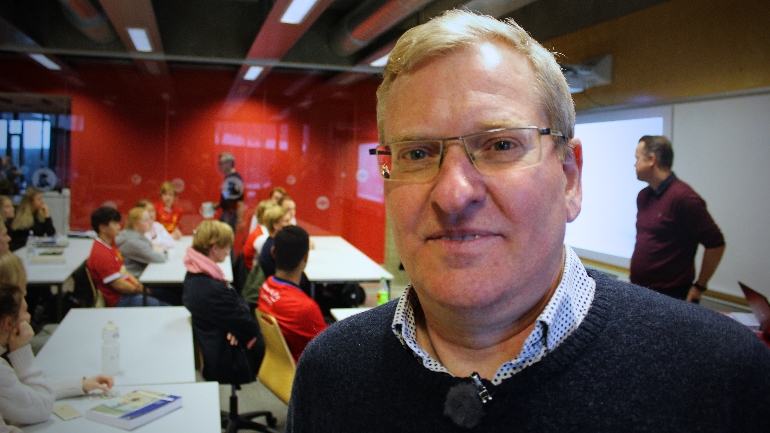
Find the location of a particular element. The height and width of the screenshot is (433, 770). background windows is located at coordinates (35, 125), (34, 153), (12, 145).